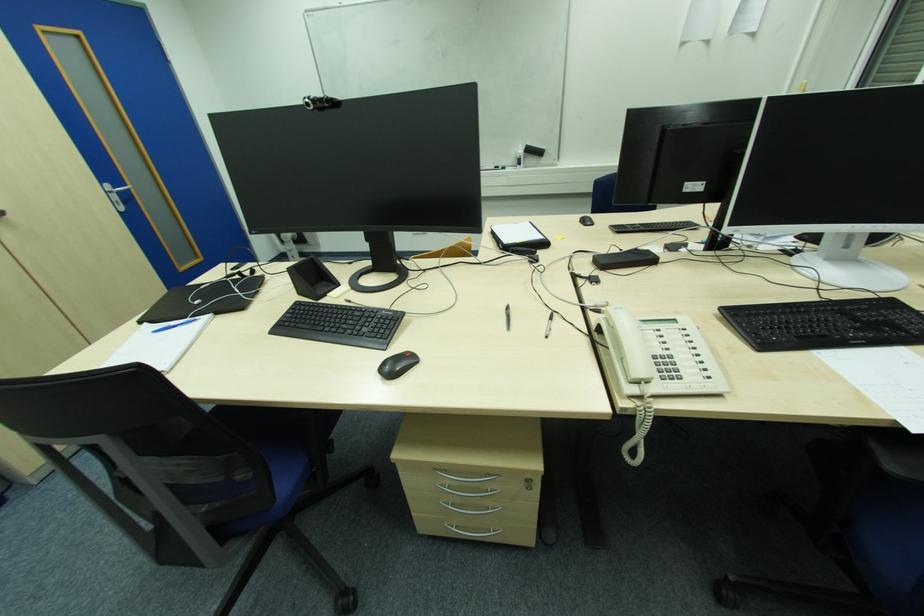
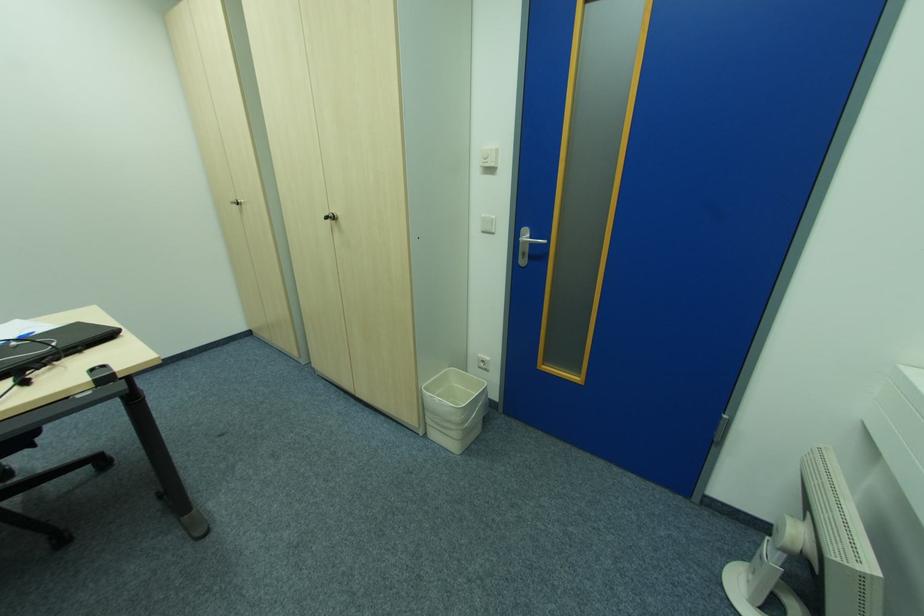
The point at (119, 204) is marked in the first image. Where is the corresponding point in the second image?

(526, 256)